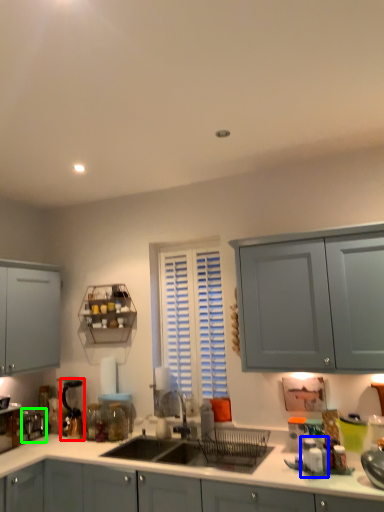
Question: Based on their relative distances, which object is nearer to coffee machine (highlighted by a red box)? Choose from appliance (highlighted by a blue box) and appliance (highlighted by a green box).

Choices:
 (A) appliance
 (B) appliance

Answer: (B)